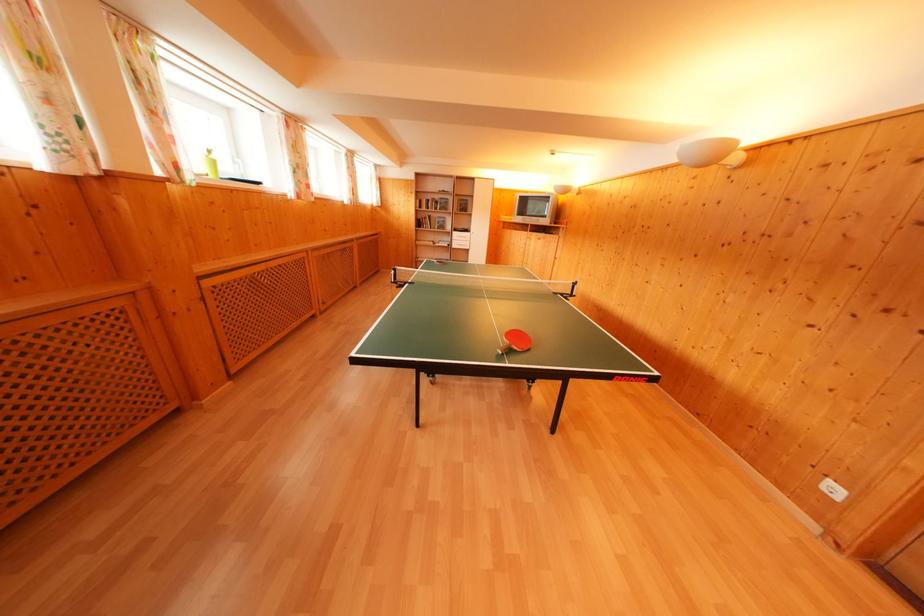
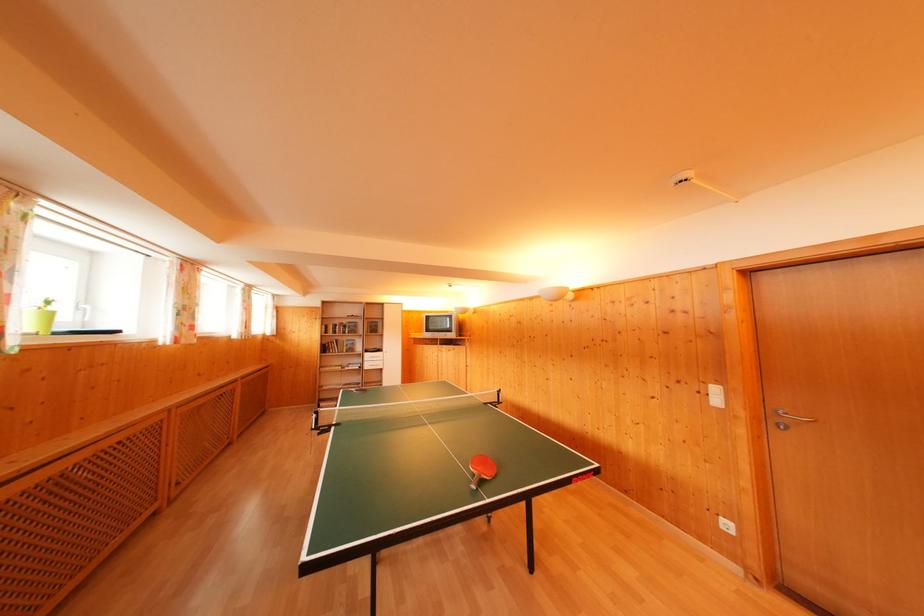
Find the pixel in the second image that matches (442,203) in the first image.

(349, 326)